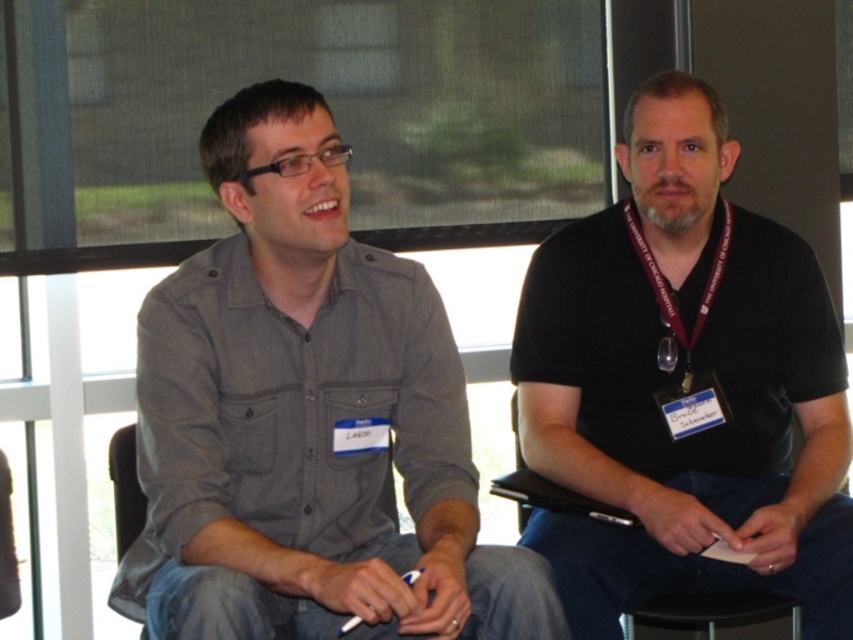
You are designing a new layout for the meeting room and need to ensure that the gray cotton shirt at left and the black leather chair at center can fit side by side without overlapping. Given their sizes, is this arrangement possible?

The gray cotton shirt at left is wider than the black leather chair at center. Since the shirt is wider, there might not be enough space to place them side by side without overlapping unless there is sufficient room allocated for the wider shirt.

You are standing in a room with a person wearing a matte gray shirt at center. If you want to hand them a document without moving closer than 5 feet, can you do it?

The matte gray shirt at center and viewer are 5.28 feet apart from each other, so yes, you can hand them the document without moving closer than 5 feet since the distance is slightly more than 5 feet.